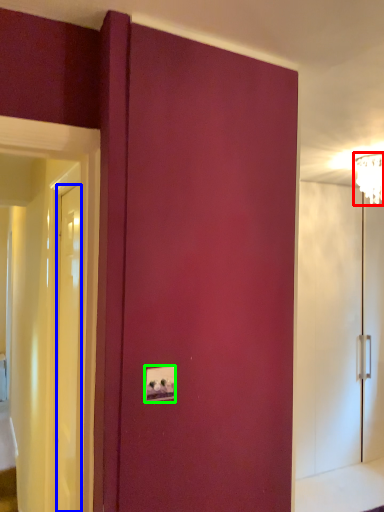
Question: Which object is the closest to the light fixture (highlighted by a red box)? Choose among these: door (highlighted by a blue box) or light switch (highlighted by a green box).

Choices:
 (A) door
 (B) light switch

Answer: (A)